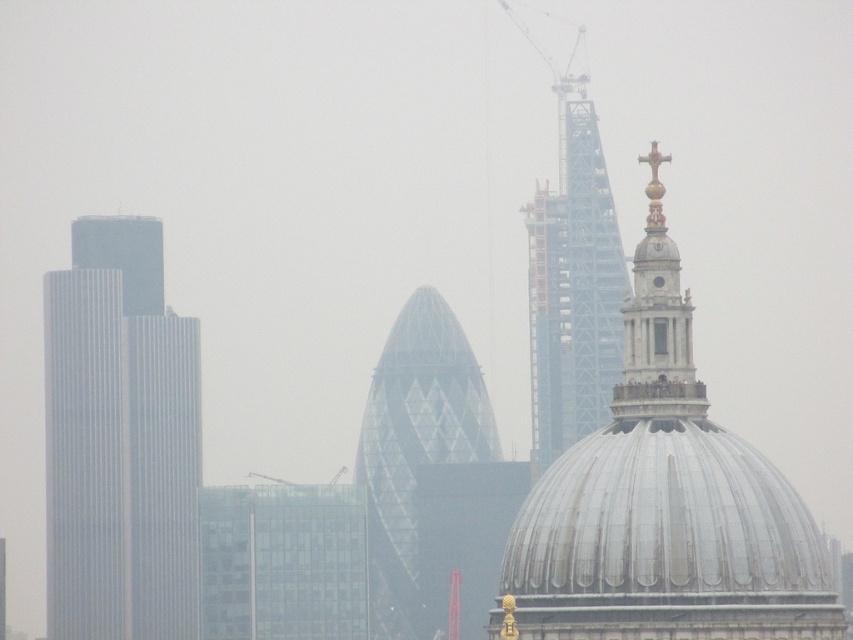
What is located at the coordinates point (663, 504) in the image?

The shiny silver dome at center is located at point (663, 504).

You are standing at the base of St. Paul Cathedral and want to take a photo that includes both point [677,465] and point [543,205]. Given that the camera you have can only focus on objects within a 0.5 unit distance from the focal point, which point should you focus on to ensure both points are in focus?

You should focus on point [543,205] because it is farther from the viewer than point [677,465]. Since the camera can focus within a 0.5 unit distance, focusing on the farther point allows the closer point to fall within the focus range.

You are a photographer planning to capture a shot of the shiny silver dome at center and the glassy steel tower at upper center. Given their spatial relationship, which object will appear larger in your photo?

The shiny silver dome at center will appear larger in the photo because it is positioned in front of the glassy steel tower at upper center, making it closer to the camera and thus appear bigger.